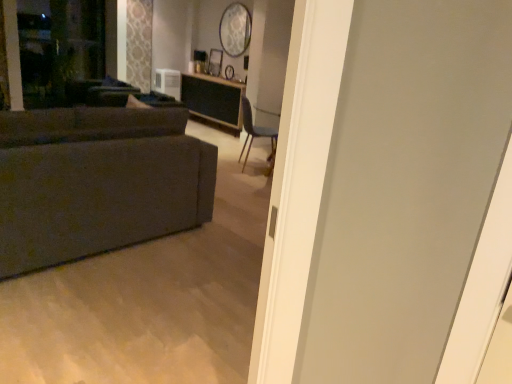
Question: Considering the relative sizes of transparent glass screen door at upper left and textured gray couch at left in the image provided, is transparent glass screen door at upper left wider than textured gray couch at left?

Choices:
 (A) no
 (B) yes

Answer: (A)

Question: Does transparent glass screen door at upper left contain textured gray couch at left?

Choices:
 (A) yes
 (B) no

Answer: (B)

Question: Is transparent glass screen door at upper left looking in the opposite direction of textured gray couch at left?

Choices:
 (A) no
 (B) yes

Answer: (A)

Question: Can you confirm if transparent glass screen door at upper left is positioned to the right of textured gray couch at left?

Choices:
 (A) yes
 (B) no

Answer: (B)

Question: Is transparent glass screen door at upper left aimed at textured gray couch at left?

Choices:
 (A) yes
 (B) no

Answer: (A)

Question: Is transparent glass screen door at upper left located outside textured gray couch at left?

Choices:
 (A) no
 (B) yes

Answer: (B)

Question: Does transparent glass screen door at upper left have a greater height compared to blue fabric chair at center?

Choices:
 (A) no
 (B) yes

Answer: (B)

Question: Is transparent glass screen door at upper left behind blue fabric chair at center?

Choices:
 (A) no
 (B) yes

Answer: (B)

Question: From a real-world perspective, is transparent glass screen door at upper left beneath blue fabric chair at center?

Choices:
 (A) yes
 (B) no

Answer: (B)

Question: Can you confirm if transparent glass screen door at upper left is shorter than blue fabric chair at center?

Choices:
 (A) yes
 (B) no

Answer: (B)

Question: Considering the relative sizes of transparent glass screen door at upper left and blue fabric chair at center in the image provided, is transparent glass screen door at upper left bigger than blue fabric chair at center?

Choices:
 (A) no
 (B) yes

Answer: (A)

Question: From a real-world perspective, is transparent glass screen door at upper left on top of blue fabric chair at center?

Choices:
 (A) no
 (B) yes

Answer: (B)

Question: Does transparent glass screen door at upper left appear on the left side of wooden table at center?

Choices:
 (A) yes
 (B) no

Answer: (A)